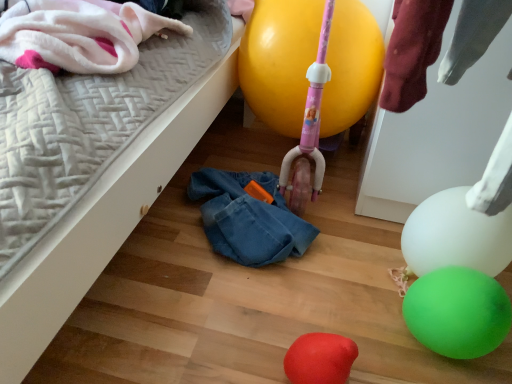
Question: Is green rubber balloon at lower right, the third balloon in the top-to-bottom sequence, bigger than yellow rubber balloon at center, the 1th balloon viewed from the top?

Choices:
 (A) no
 (B) yes

Answer: (A)

Question: Can you confirm if green rubber balloon at lower right, the third balloon in the top-to-bottom sequence, is thinner than yellow rubber balloon at center, the 4th balloon from the bottom?

Choices:
 (A) no
 (B) yes

Answer: (B)

Question: Considering the relative sizes of green rubber balloon at lower right, the third balloon in the top-to-bottom sequence, and yellow rubber balloon at center, the 1th balloon viewed from the top, in the image provided, is green rubber balloon at lower right, the third balloon in the top-to-bottom sequence, taller than yellow rubber balloon at center, the 1th balloon viewed from the top,?

Choices:
 (A) no
 (B) yes

Answer: (A)

Question: From the image's perspective, is green rubber balloon at lower right, the 2th balloon from the bottom, below yellow rubber balloon at center, the 4th balloon from the bottom?

Choices:
 (A) yes
 (B) no

Answer: (A)

Question: From the image's perspective, is green rubber balloon at lower right, the third balloon in the top-to-bottom sequence, located above yellow rubber balloon at center, the 1th balloon viewed from the top?

Choices:
 (A) yes
 (B) no

Answer: (B)

Question: Considering the positions of green rubber balloon at lower right, the 2th balloon from the bottom, and rubber balloon at lower center, which is the fourth balloon from top to bottom, in the image, is green rubber balloon at lower right, the 2th balloon from the bottom, bigger or smaller than rubber balloon at lower center, which is the fourth balloon from top to bottom,?

Choices:
 (A) big
 (B) small

Answer: (A)

Question: In terms of width, does green rubber balloon at lower right, the 2th balloon from the bottom, look wider or thinner when compared to rubber balloon at lower center, which is the fourth balloon from top to bottom?

Choices:
 (A) wide
 (B) thin

Answer: (A)

Question: Is green rubber balloon at lower right, the third balloon in the top-to-bottom sequence, in front of or behind rubber balloon at lower center, which is the fourth balloon from top to bottom, in the image?

Choices:
 (A) front
 (B) behind

Answer: (B)

Question: Is green rubber balloon at lower right, the third balloon in the top-to-bottom sequence, to the left or to the right of rubber balloon at lower center, which is the fourth balloon from top to bottom, in the image?

Choices:
 (A) left
 (B) right

Answer: (B)

Question: From a real-world perspective, is yellow rubber balloon at center, the 4th balloon from the bottom, above or below white glossy balloon at lower right, the third balloon positioned from the bottom?

Choices:
 (A) below
 (B) above

Answer: (B)

Question: Looking at their shapes, would you say yellow rubber balloon at center, the 4th balloon from the bottom, is wider or thinner than white glossy balloon at lower right, the third balloon positioned from the bottom?

Choices:
 (A) wide
 (B) thin

Answer: (A)

Question: Is yellow rubber balloon at center, the 1th balloon viewed from the top, inside the boundaries of white glossy balloon at lower right, marked as the second balloon in a top-to-bottom arrangement, or outside?

Choices:
 (A) outside
 (B) inside

Answer: (A)

Question: Does point (331, 64) appear closer or farther from the camera than point (450, 236)?

Choices:
 (A) closer
 (B) farther

Answer: (B)

Question: From a real-world perspective, is yellow rubber balloon at center, the 4th balloon from the bottom, positioned above or below fluffy white blanket at upper left?

Choices:
 (A) above
 (B) below

Answer: (B)

Question: Is yellow rubber balloon at center, the 1th balloon viewed from the top, inside the boundaries of fluffy white blanket at upper left, or outside?

Choices:
 (A) inside
 (B) outside

Answer: (B)